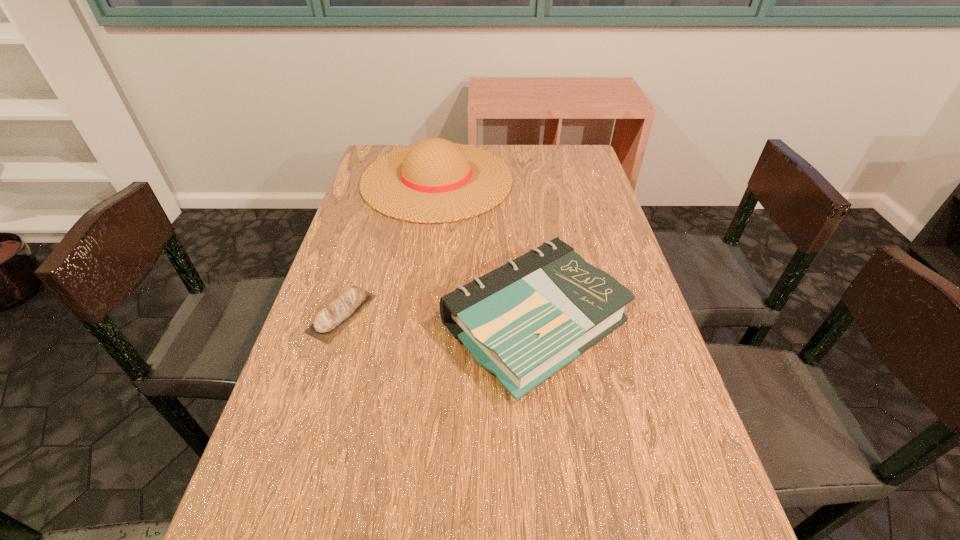
Locate an element on the screen. This screenshot has height=540, width=960. the farthest object is located at coordinates (435, 181).

The width and height of the screenshot is (960, 540). In order to click on the tallest object in this screenshot , I will do click(435, 181).

You are a GUI agent. You are given a task and a screenshot of the screen. Output one action in this format:
    pyautogui.click(x=<x>, y=<y>)
    Task: Click on the second tallest object
    The height and width of the screenshot is (540, 960).
    Given the screenshot: What is the action you would take?
    pyautogui.click(x=524, y=321)

The width and height of the screenshot is (960, 540). I want to click on the shortest object, so (329, 321).

At what (x,y) coordinates should I click in order to perform the action: click on free spot located on the front of the farthest object. Please return your answer as a coordinate pair (x, y). Image resolution: width=960 pixels, height=540 pixels. Looking at the image, I should click on (419, 315).

This screenshot has width=960, height=540. Find the location of `free region located on the left of the second tallest object`. free region located on the left of the second tallest object is located at coordinates (334, 324).

Locate an element on the screen. vacant space located on the front of the pita bread is located at coordinates (300, 453).

Find the location of a particular element. The width and height of the screenshot is (960, 540). object at the far edge is located at coordinates (435, 181).

The height and width of the screenshot is (540, 960). Identify the location of bonnet that is at the left edge. (435, 181).

Image resolution: width=960 pixels, height=540 pixels. In order to click on pita bread at the left edge in this screenshot , I will do `click(329, 321)`.